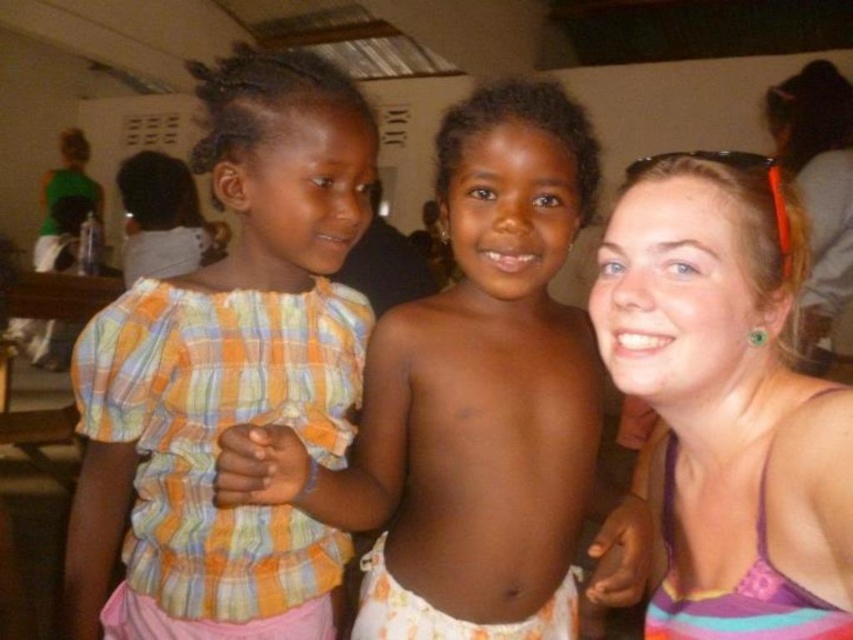
You are a fashion designer observing the scene. You notice the plaid fabric shirt at center and the pink fabric tank top at right. Which clothing item is positioned higher in the image?

The plaid fabric shirt at center is located above the pink fabric tank top at right, so it is positioned higher in the image.

You are a photographer setting up for a group photo. You need to ensure that the plaid fabric shirt at left and the pink fabric tank top at right are at least 16 inches apart to avoid overcrowding. Based on the scene description, will their current positions meet this requirement?

The distance between the plaid fabric shirt at left and the pink fabric tank top at right is 15.91 inches, which is slightly less than the required 16 inches. Therefore, their current positions do not meet the requirement, and they should move slightly farther apart to ensure proper spacing.

You are standing at the origin point in the image. There are two points marked in the scene. Which one is closer to you, point (389, 502) or point (740, 628)?

Point (740, 628) is closer to you because the description states that point (389, 502) is behind point (740, 628).